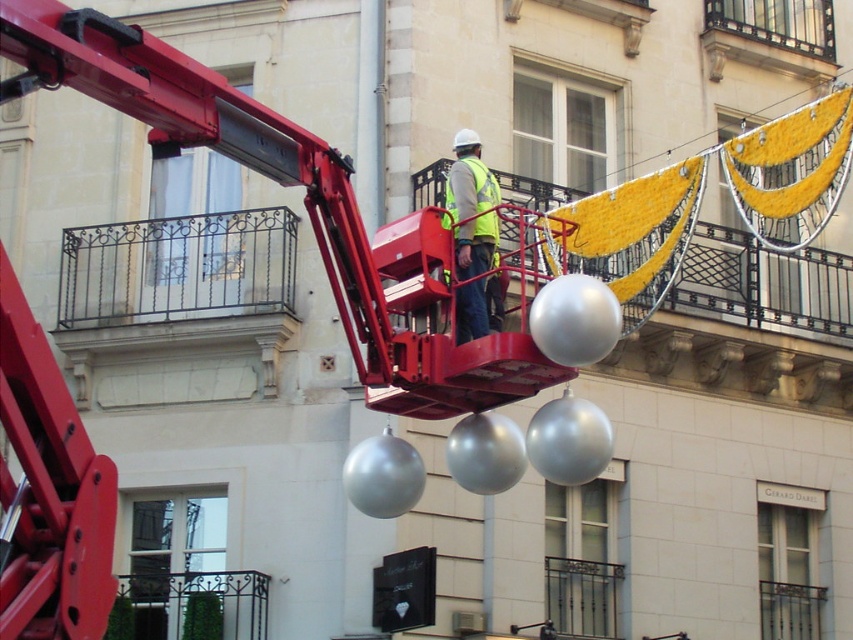
Question: Which is nearer to the reflective silver vest at center?

Choices:
 (A) yellow reflective safety vest at center
 (B) wrought iron balcony at upper left

Answer: (A)

Question: Is reflective silver vest at center above yellow reflective safety vest at center?

Choices:
 (A) no
 (B) yes

Answer: (B)

Question: Which point is closer to the camera?

Choices:
 (A) (456, 209)
 (B) (96, 237)
 (C) (495, 186)

Answer: (A)

Question: Where is reflective silver vest at center located in relation to yellow reflective safety vest at center in the image?

Choices:
 (A) above
 (B) below

Answer: (A)

Question: Which object is the closest to the wrought iron balcony at upper left?

Choices:
 (A) reflective silver vest at center
 (B) yellow reflective safety vest at center

Answer: (B)

Question: Does wrought iron balcony at upper left lie in front of reflective silver vest at center?

Choices:
 (A) yes
 (B) no

Answer: (B)